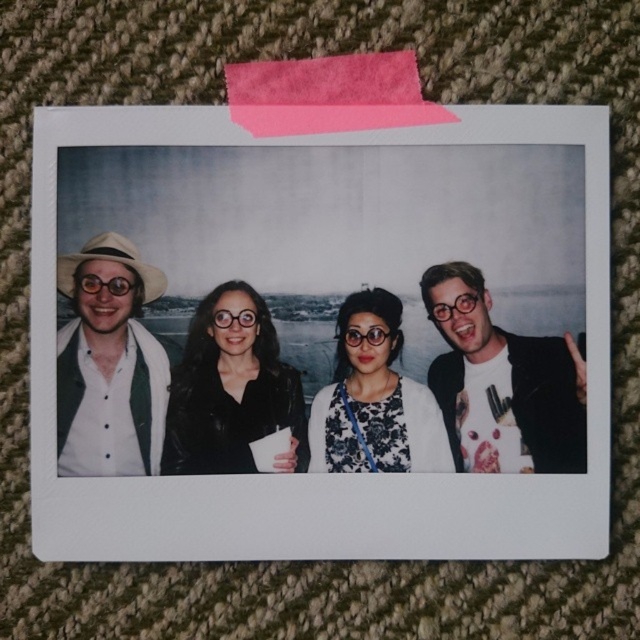
Question: Estimate the real-world distances between objects in this image. Which object is farther from the matte white hat at left?

Choices:
 (A) black leather jacket at center
 (B) floral fabric blouse at center
 (C) matte black jacket at right

Answer: (C)

Question: Is matte white hat at left thinner than floral fabric blouse at center?

Choices:
 (A) yes
 (B) no

Answer: (A)

Question: Which object is the farthest from the matte black jacket at right?

Choices:
 (A) black leather jacket at center
 (B) floral fabric blouse at center
 (C) matte white hat at left

Answer: (C)

Question: Does black leather jacket at center appear under floral fabric blouse at center?

Choices:
 (A) yes
 (B) no

Answer: (B)

Question: Considering the relative positions of black leather jacket at center and floral fabric blouse at center in the image provided, where is black leather jacket at center located with respect to floral fabric blouse at center?

Choices:
 (A) left
 (B) right

Answer: (A)

Question: Which point is farther from the camera taking this photo?

Choices:
 (A) (452, 436)
 (B) (381, 316)
 (C) (220, 461)
 (D) (104, 307)

Answer: (A)